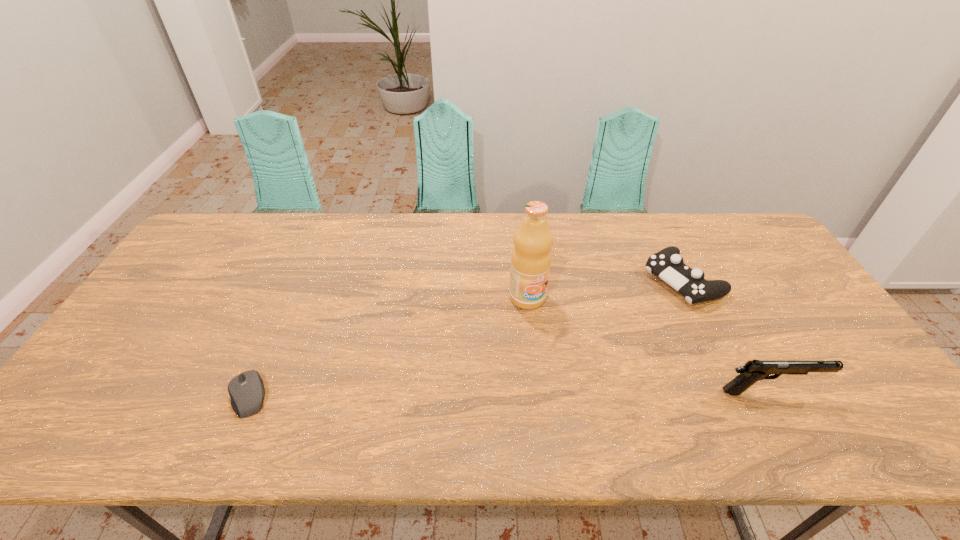
Locate an element on the screen. Image resolution: width=960 pixels, height=540 pixels. vacant position at the near edge of the desktop is located at coordinates (648, 404).

In the image, there is a desktop. Identify the location of free region at the left edge. Image resolution: width=960 pixels, height=540 pixels. (157, 368).

Locate an element on the screen. The width and height of the screenshot is (960, 540). vacant space at the right edge of the desktop is located at coordinates (837, 353).

Where is `vacant region at the far left corner`? The width and height of the screenshot is (960, 540). vacant region at the far left corner is located at coordinates (252, 218).

At what (x,y) coordinates should I click in order to perform the action: click on vacant space at the near left corner of the desktop. Please return your answer as a coordinate pair (x, y). This screenshot has width=960, height=540. Looking at the image, I should click on (124, 382).

You are a GUI agent. You are given a task and a screenshot of the screen. Output one action in this format:
    pyautogui.click(x=<x>, y=<y>)
    Task: Click on the vacant space at the far right corner
    This screenshot has height=540, width=960.
    Given the screenshot: What is the action you would take?
    point(720,238)

Find the location of a particular element. This screenshot has width=960, height=540. vacant space at the near right corner of the desktop is located at coordinates (825, 384).

Where is `empty space that is in between the third tallest object and the second tallest object`? This screenshot has height=540, width=960. empty space that is in between the third tallest object and the second tallest object is located at coordinates (726, 336).

You are a GUI agent. You are given a task and a screenshot of the screen. Output one action in this format:
    pyautogui.click(x=<x>, y=<y>)
    Task: Click on the vacant space in between the control and the computer equipment
    
    Given the screenshot: What is the action you would take?
    (x=466, y=338)

Where is `vacant space in between the second shortest object and the second tallest object`? This screenshot has width=960, height=540. vacant space in between the second shortest object and the second tallest object is located at coordinates (726, 336).